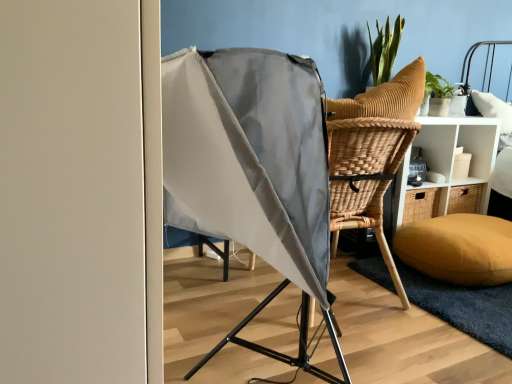
Where is `soft yellow mat at lower right`? soft yellow mat at lower right is located at coordinates (464, 306).

I want to click on brown wicker chair at center right, so click(451, 154).

Locate an element on the screen. This screenshot has width=512, height=384. mustard yellow fabric pillow at lower right is located at coordinates (458, 248).

This screenshot has height=384, width=512. I want to click on soft yellow mat at lower right, so click(464, 306).

Identify the location of mat that appears in front of the brown wicker chair at center right. The width and height of the screenshot is (512, 384). (464, 306).

Measure the distance from soft yellow mat at lower right to brown wicker chair at center right.

The distance of soft yellow mat at lower right from brown wicker chair at center right is 25.81 inches.

Can you see soft yellow mat at lower right touching brown wicker chair at center right?

soft yellow mat at lower right and brown wicker chair at center right are not in contact.

From a real-world perspective, is mustard yellow fabric pillow at lower right beneath soft yellow mat at lower right?

Incorrect, from a real-world perspective, mustard yellow fabric pillow at lower right is higher than soft yellow mat at lower right.

From the picture: Which is in front, mustard yellow fabric pillow at lower right or soft yellow mat at lower right?

soft yellow mat at lower right.

Considering the positions of objects mustard yellow fabric pillow at lower right and soft yellow mat at lower right in the image provided, who is more to the left, mustard yellow fabric pillow at lower right or soft yellow mat at lower right?

Positioned to the left is soft yellow mat at lower right.

Measure the distance between mustard yellow fabric pillow at lower right and soft yellow mat at lower right.

The distance of mustard yellow fabric pillow at lower right from soft yellow mat at lower right is 7.29 inches.

Is soft yellow mat at lower right oriented away from mustard yellow fabric pillow at lower right?

soft yellow mat at lower right does not have its back to mustard yellow fabric pillow at lower right.

Is soft yellow mat at lower right with mustard yellow fabric pillow at lower right?

No, soft yellow mat at lower right is not making contact with mustard yellow fabric pillow at lower right.

Is soft yellow mat at lower right in front of or behind mustard yellow fabric pillow at lower right in the image?

In the image, soft yellow mat at lower right appears in front of mustard yellow fabric pillow at lower right.

Are brown wicker chair at center right and soft yellow mat at lower right located far from each other?

Actually, brown wicker chair at center right and soft yellow mat at lower right are a little close together.

From a real-world perspective, which object stands above the other?

From a 3D spatial view, brown wicker chair at center right is above.

Does point (470, 141) come in front of point (486, 293)?

No, it is not.

Does brown wicker chair at center right have a greater width compared to soft yellow mat at lower right?

In fact, brown wicker chair at center right might be narrower than soft yellow mat at lower right.

From the picture: Is mustard yellow fabric pillow at lower right to the left of brown wicker chair at center right from the viewer's perspective?

No, mustard yellow fabric pillow at lower right is not to the left of brown wicker chair at center right.

Does mustard yellow fabric pillow at lower right lie behind brown wicker chair at center right?

No, mustard yellow fabric pillow at lower right is closer to the camera.

Is point (476, 252) farther from camera compared to point (483, 192)?

No, it is in front of (483, 192).

From the image's perspective, is brown wicker chair at center right positioned above or below mustard yellow fabric pillow at lower right?

Based on their image positions, brown wicker chair at center right is located above mustard yellow fabric pillow at lower right.

In terms of width, does brown wicker chair at center right look wider or thinner when compared to mustard yellow fabric pillow at lower right?

Clearly, brown wicker chair at center right has less width compared to mustard yellow fabric pillow at lower right.

Who is smaller, brown wicker chair at center right or mustard yellow fabric pillow at lower right?

Smaller between the two is mustard yellow fabric pillow at lower right.

Locate an element on the screen. pillow in front of the brown wicker chair at center right is located at coordinates (458, 248).

I want to click on mat on the left of brown wicker chair at center right, so click(464, 306).

Where is `mat directly beneath the mustard yellow fabric pillow at lower right (from a real-world perspective)`? mat directly beneath the mustard yellow fabric pillow at lower right (from a real-world perspective) is located at coordinates (464, 306).

Considering their positions, is soft yellow mat at lower right positioned closer to brown wicker chair at center right than mustard yellow fabric pillow at lower right?

mustard yellow fabric pillow at lower right.

Consider the image. From the image, which object appears to be nearer to soft yellow mat at lower right, brown wicker chair at center right or mustard yellow fabric pillow at lower right?

mustard yellow fabric pillow at lower right lies closer to soft yellow mat at lower right than the other object.

Looking at the image, which one is located closer to mustard yellow fabric pillow at lower right, soft yellow mat at lower right or brown wicker chair at center right?

soft yellow mat at lower right is closer to mustard yellow fabric pillow at lower right.

Estimate the real-world distances between objects in this image. Which object is closer to soft yellow mat at lower right, mustard yellow fabric pillow at lower right or brown wicker chair at center right?

mustard yellow fabric pillow at lower right.

When comparing their distances from mustard yellow fabric pillow at lower right, does brown wicker chair at center right or soft yellow mat at lower right seem closer?

soft yellow mat at lower right is positioned closer to the anchor mustard yellow fabric pillow at lower right.

Looking at this image, estimate the real-world distances between objects in this image. Which object is closer to brown wicker chair at center right, mustard yellow fabric pillow at lower right or soft yellow mat at lower right?

mustard yellow fabric pillow at lower right is closer to brown wicker chair at center right.

This screenshot has width=512, height=384. In order to click on pillow located between soft yellow mat at lower right and brown wicker chair at center right in the depth direction in this screenshot , I will do `click(458, 248)`.